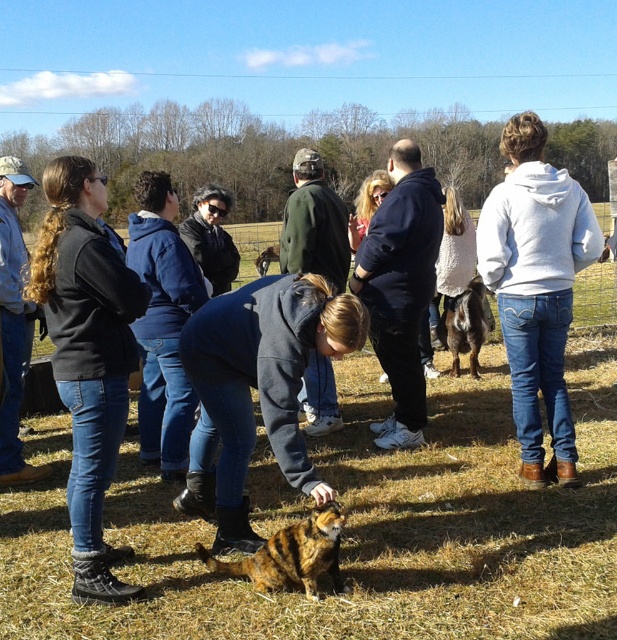
Question: Which of the following is the farthest from the observer?

Choices:
 (A) click(x=64, y=211)
 (B) click(x=357, y=218)

Answer: (B)

Question: Which point is closer to the camera?

Choices:
 (A) (489, 275)
 (B) (263, 250)
 (C) (358, 195)
 (D) (318, 518)

Answer: (D)

Question: Which object is farther from the camera taking this photo?

Choices:
 (A) dark blue jeans at left
 (B) white hoodie at upper right
 (C) dark blue hoodie at center

Answer: (C)

Question: In this image, where is striped fur cat at center located relative to white sweater at center?

Choices:
 (A) left
 (B) right

Answer: (A)

Question: Is dark blue jeans at left thinner than dark blue hoodie at center?

Choices:
 (A) yes
 (B) no

Answer: (B)

Question: Can you confirm if dark blue jeans at left is wider than brown fuzzy goat at center?

Choices:
 (A) yes
 (B) no

Answer: (A)